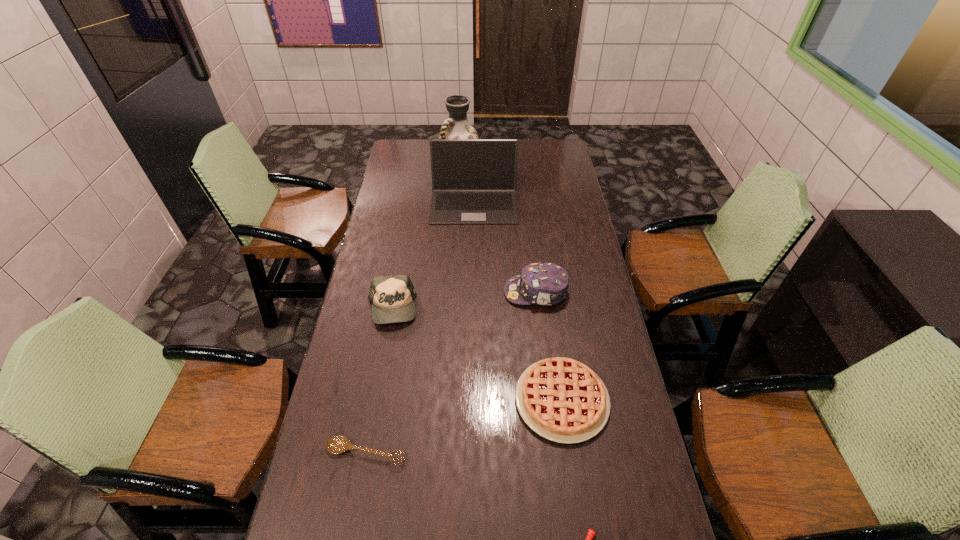
At what (x,y) coordinates should I click in order to perform the action: click on free space located on the front-facing side of the fifth shortest object. Please return your answer as a coordinate pair (x, y). Image resolution: width=960 pixels, height=540 pixels. Looking at the image, I should click on (441, 292).

What are the coordinates of `vacant point located 0.120m on the front-facing side of the fifth shortest object` in the screenshot? It's located at coord(471,292).

The height and width of the screenshot is (540, 960). In order to click on free space located on the front-facing side of the fifth shortest object in this screenshot , I will do `click(463, 292)`.

The width and height of the screenshot is (960, 540). I want to click on free location located on the front-facing side of the baseball cap, so click(x=384, y=352).

You are a GUI agent. You are given a task and a screenshot of the screen. Output one action in this format:
    pyautogui.click(x=<x>, y=<y>)
    Task: Click on the free location located 0.180m on the front of the pie
    The width and height of the screenshot is (960, 540).
    Given the screenshot: What is the action you would take?
    pyautogui.click(x=579, y=518)

Identify the location of free region located on the right of the ladle. (425, 453).

This screenshot has height=540, width=960. Find the location of `object that is at the far edge`. object that is at the far edge is located at coordinates (456, 126).

Identify the location of baseball cap present at the left edge. (392, 297).

The image size is (960, 540). I want to click on ladle at the left edge, so click(337, 444).

Locate an element on the screen. The height and width of the screenshot is (540, 960). headwear present at the right edge is located at coordinates (547, 284).